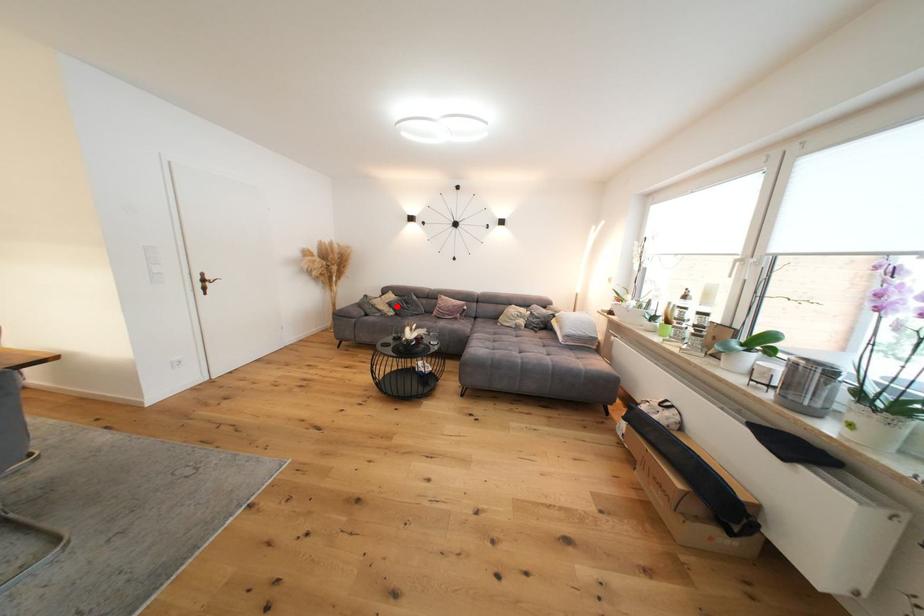
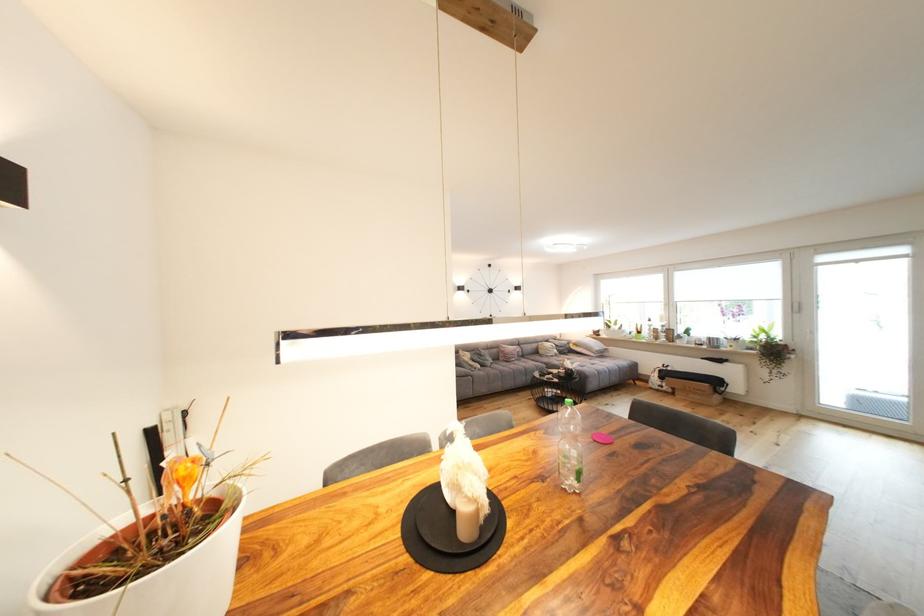
In the second image, find the point that corresponds to the highlighted location in the first image.

(480, 361)